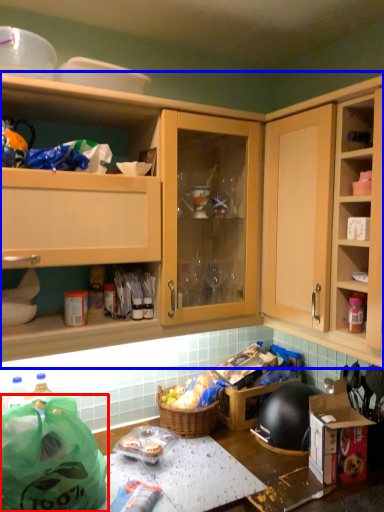
Question: Which object is closer to the camera taking this photo, bag (highlighted by a red box) or cabinetry (highlighted by a blue box)?

Choices:
 (A) bag
 (B) cabinetry

Answer: (A)